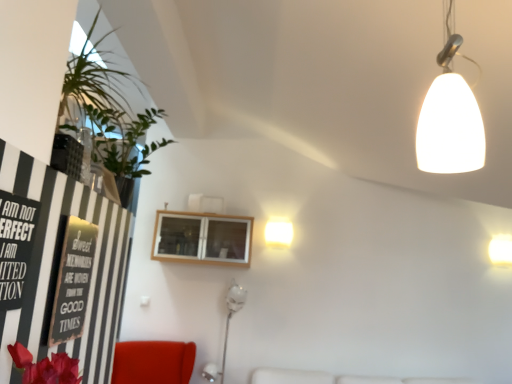
Question: Is velvet red armchair at lower left a part of black paper poster at left?

Choices:
 (A) no
 (B) yes

Answer: (A)

Question: From the image's perspective, is black paper poster at left above velvet red armchair at lower left?

Choices:
 (A) yes
 (B) no

Answer: (A)

Question: Can you confirm if black paper poster at left is positioned to the right of velvet red armchair at lower left?

Choices:
 (A) yes
 (B) no

Answer: (A)

Question: Does black paper poster at left appear on the left side of velvet red armchair at lower left?

Choices:
 (A) no
 (B) yes

Answer: (A)

Question: Is black paper poster at left beside velvet red armchair at lower left?

Choices:
 (A) yes
 (B) no

Answer: (B)

Question: Is black paper poster at left shorter than velvet red armchair at lower left?

Choices:
 (A) yes
 (B) no

Answer: (A)

Question: Is white glossy wall sconce at upper right, acting as the first lamp starting from the right, not within white glossy wall lamp at upper center, which ranks as the first lamp in back-to-front order?

Choices:
 (A) no
 (B) yes

Answer: (B)

Question: Does white glossy wall sconce at upper right, the 2th lamp when ordered from front to back, have a greater width compared to white glossy wall lamp at upper center, which ranks as the 1th lamp in left-to-right order?

Choices:
 (A) no
 (B) yes

Answer: (B)

Question: Is white glossy wall sconce at upper right, the 1th lamp from the bottom, further to the viewer compared to white glossy wall lamp at upper center, which ranks as the first lamp in back-to-front order?

Choices:
 (A) no
 (B) yes

Answer: (A)

Question: Is white glossy wall sconce at upper right, the 1th lamp from the bottom, at the right side of white glossy wall lamp at upper center, which is the second lamp from bottom to top?

Choices:
 (A) no
 (B) yes

Answer: (B)

Question: Is white glossy wall sconce at upper right, the 1th lamp from the bottom, taller than white glossy wall lamp at upper center, positioned as the third lamp in front-to-back order?

Choices:
 (A) no
 (B) yes

Answer: (A)

Question: From a real-world perspective, does white glossy wall sconce at upper right, marked as the 2th lamp in a back-to-front arrangement, stand above white glossy wall lamp at upper center, which is the second lamp in top-to-bottom order?

Choices:
 (A) yes
 (B) no

Answer: (B)

Question: From a real-world perspective, is white glossy lamp at lower center located beneath green leafy plant at upper left?

Choices:
 (A) no
 (B) yes

Answer: (B)